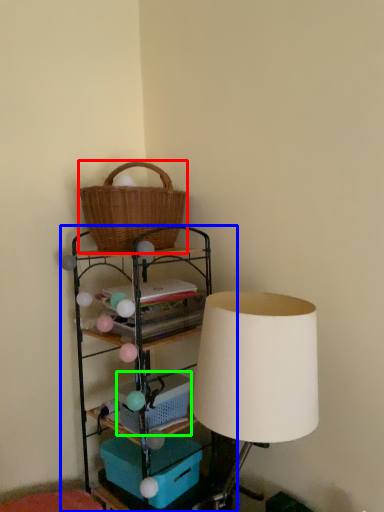
Question: Which is farther away from picnic basket (highlighted by a red box)? shelf (highlighted by a blue box) or basket (highlighted by a green box)?

Choices:
 (A) shelf
 (B) basket

Answer: (B)